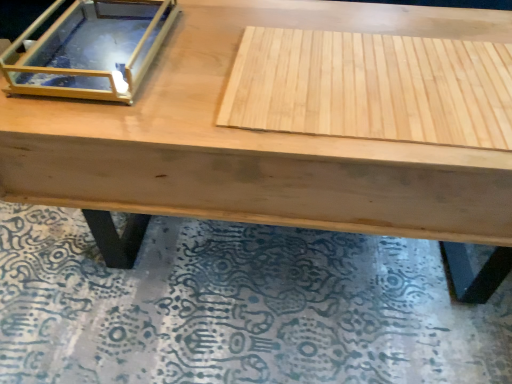
Question: Is wooden mat at lower center not near clear glass box at upper left?

Choices:
 (A) no
 (B) yes

Answer: (A)

Question: Is clear glass box at upper left inside wooden mat at lower center?

Choices:
 (A) yes
 (B) no

Answer: (B)

Question: From a real-world perspective, is wooden mat at lower center under clear glass box at upper left?

Choices:
 (A) yes
 (B) no

Answer: (A)

Question: Is wooden mat at lower center not inside clear glass box at upper left?

Choices:
 (A) yes
 (B) no

Answer: (A)

Question: Is wooden mat at lower center oriented towards clear glass box at upper left?

Choices:
 (A) no
 (B) yes

Answer: (A)

Question: Is wooden mat at lower center smaller than clear glass box at upper left?

Choices:
 (A) no
 (B) yes

Answer: (A)

Question: Does wooden mat at lower center appear on the right side of natural wood plywood at center?

Choices:
 (A) yes
 (B) no

Answer: (B)

Question: From a real-world perspective, is wooden mat at lower center beneath natural wood plywood at center?

Choices:
 (A) yes
 (B) no

Answer: (A)

Question: Would you say wooden mat at lower center contains natural wood plywood at center?

Choices:
 (A) no
 (B) yes

Answer: (A)

Question: Is wooden mat at lower center far away from natural wood plywood at center?

Choices:
 (A) no
 (B) yes

Answer: (A)

Question: Does wooden mat at lower center have a greater height compared to natural wood plywood at center?

Choices:
 (A) no
 (B) yes

Answer: (A)

Question: Is wooden mat at lower center behind natural wood plywood at center?

Choices:
 (A) no
 (B) yes

Answer: (B)

Question: Can you confirm if clear glass box at upper left is thinner than wooden mat at lower center?

Choices:
 (A) no
 (B) yes

Answer: (B)